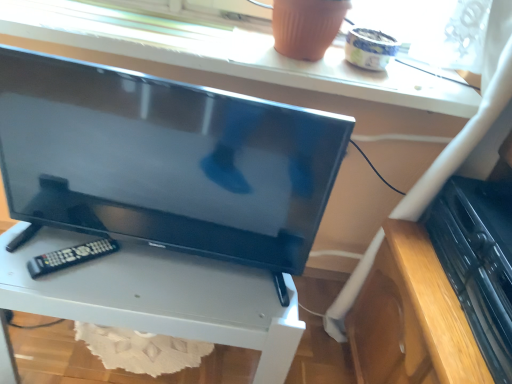
Question: Considering the relative sizes of white glossy tv stand at center and black plastic remote at lower left in the image provided, is white glossy tv stand at center shorter than black plastic remote at lower left?

Choices:
 (A) no
 (B) yes

Answer: (A)

Question: Is white glossy tv stand at center positioned behind black plastic remote at lower left?

Choices:
 (A) yes
 (B) no

Answer: (B)

Question: Considering the relative sizes of white glossy tv stand at center and black plastic remote at lower left in the image provided, is white glossy tv stand at center thinner than black plastic remote at lower left?

Choices:
 (A) no
 (B) yes

Answer: (A)

Question: Is white glossy tv stand at center not within black plastic remote at lower left?

Choices:
 (A) yes
 (B) no

Answer: (A)

Question: Considering the relative sizes of white glossy tv stand at center and black plastic remote at lower left in the image provided, is white glossy tv stand at center wider than black plastic remote at lower left?

Choices:
 (A) no
 (B) yes

Answer: (B)

Question: Considering the positions of black plastic dvd player at lower right and matte black tv at center in the image, is black plastic dvd player at lower right taller or shorter than matte black tv at center?

Choices:
 (A) tall
 (B) short

Answer: (B)

Question: From a real-world perspective, is black plastic dvd player at lower right physically located above or below matte black tv at center?

Choices:
 (A) below
 (B) above

Answer: (A)

Question: Do you think black plastic dvd player at lower right is within matte black tv at center, or outside of it?

Choices:
 (A) inside
 (B) outside

Answer: (B)

Question: Is point (500, 203) positioned closer to the camera than point (170, 178)?

Choices:
 (A) farther
 (B) closer

Answer: (A)

Question: Considering the relative positions of black plastic dvd player at lower right and black plastic remote at lower left in the image provided, is black plastic dvd player at lower right to the left or to the right of black plastic remote at lower left?

Choices:
 (A) left
 (B) right

Answer: (B)

Question: From a real-world perspective, is black plastic dvd player at lower right physically located above or below black plastic remote at lower left?

Choices:
 (A) below
 (B) above

Answer: (B)

Question: From the image's perspective, is black plastic dvd player at lower right positioned above or below black plastic remote at lower left?

Choices:
 (A) above
 (B) below

Answer: (A)

Question: Is black plastic dvd player at lower right bigger or smaller than black plastic remote at lower left?

Choices:
 (A) big
 (B) small

Answer: (A)

Question: Based on their sizes in the image, would you say matte white window sill at upper center is bigger or smaller than black plastic dvd player at lower right?

Choices:
 (A) small
 (B) big

Answer: (B)

Question: From the image's perspective, relative to black plastic dvd player at lower right, is matte white window sill at upper center above or below?

Choices:
 (A) above
 (B) below

Answer: (A)